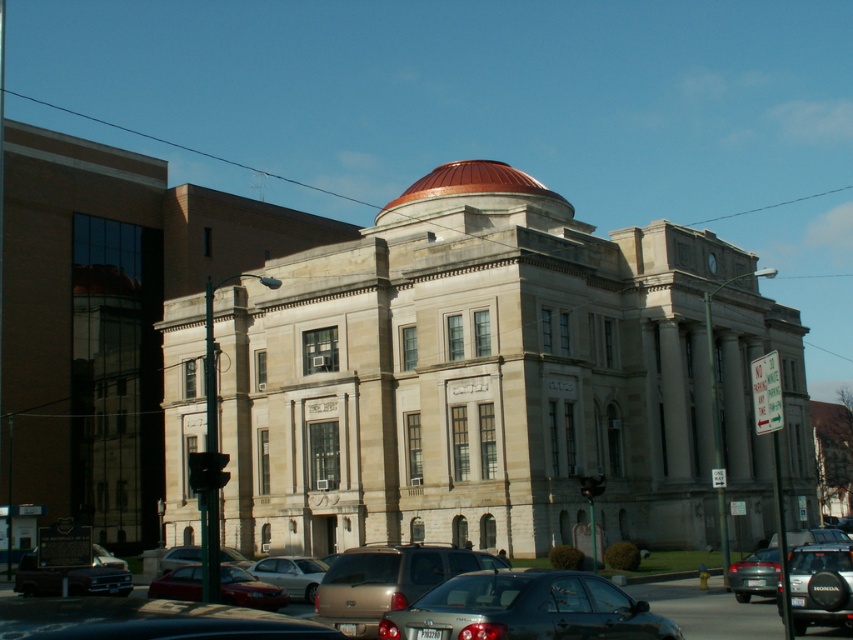
Question: Is metallic gray sedan at center further to camera compared to shiny black sedan at lower left?

Choices:
 (A) yes
 (B) no

Answer: (B)

Question: Does gold metallic suv at center appear under black matte suv at lower right?

Choices:
 (A) no
 (B) yes

Answer: (B)

Question: Which point appears closest to the camera in this image?

Choices:
 (A) (675, 627)
 (B) (369, 580)

Answer: (A)

Question: Considering the real-world distances, which object is closest to the shiny red sedan at lower left?

Choices:
 (A) metallic gray sedan at center
 (B) metallic silver sedan at center
 (C) gold metallic suv at center

Answer: (C)

Question: Considering the relative positions of shiny black sedan at lower left and matte silver sedan at lower right in the image provided, where is shiny black sedan at lower left located with respect to matte silver sedan at lower right?

Choices:
 (A) left
 (B) right

Answer: (A)

Question: Among these objects, which one is nearest to the camera?

Choices:
 (A) metallic gray sedan at center
 (B) black matte suv at lower right
 (C) silver metallic sedan at center
 (D) metallic silver sedan at center

Answer: (A)